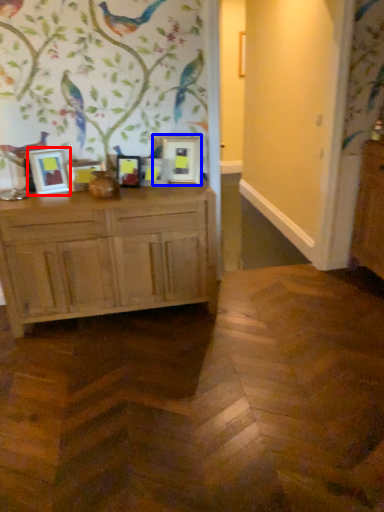
Question: Which of the following is the closest to the observer, picture frame (highlighted by a red box) or picture frame (highlighted by a blue box)?

Choices:
 (A) picture frame
 (B) picture frame

Answer: (A)